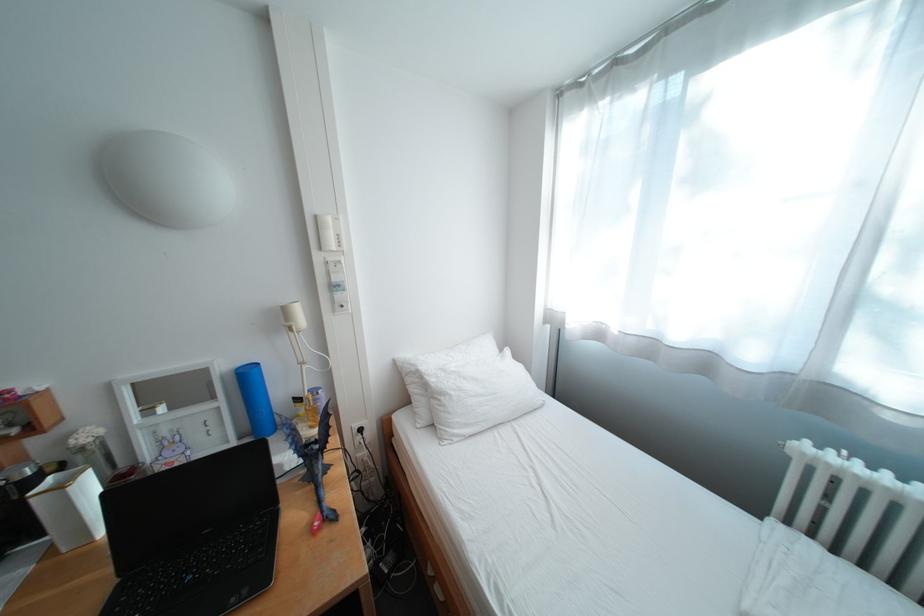
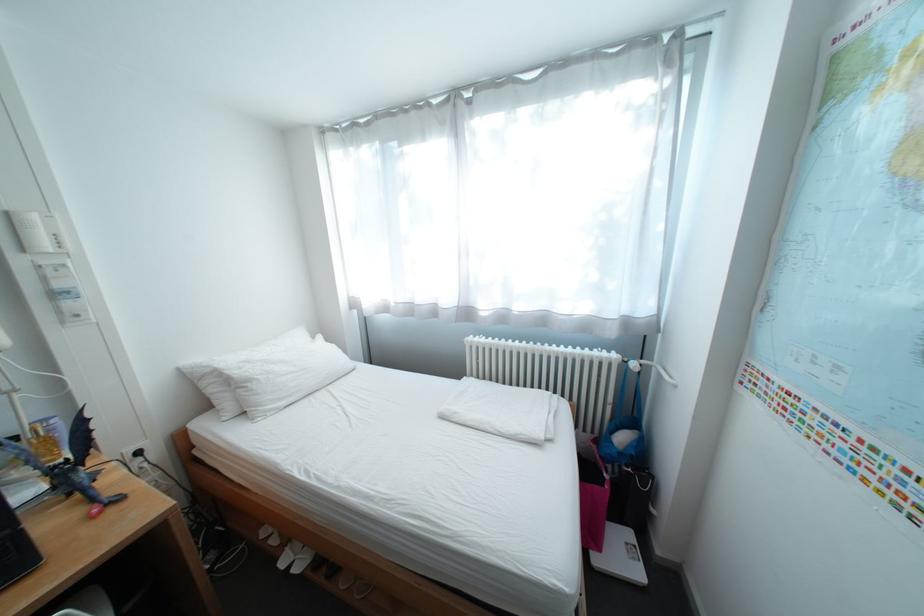
The point at (456, 397) is marked in the first image. Where is the corresponding point in the second image?

(263, 383)